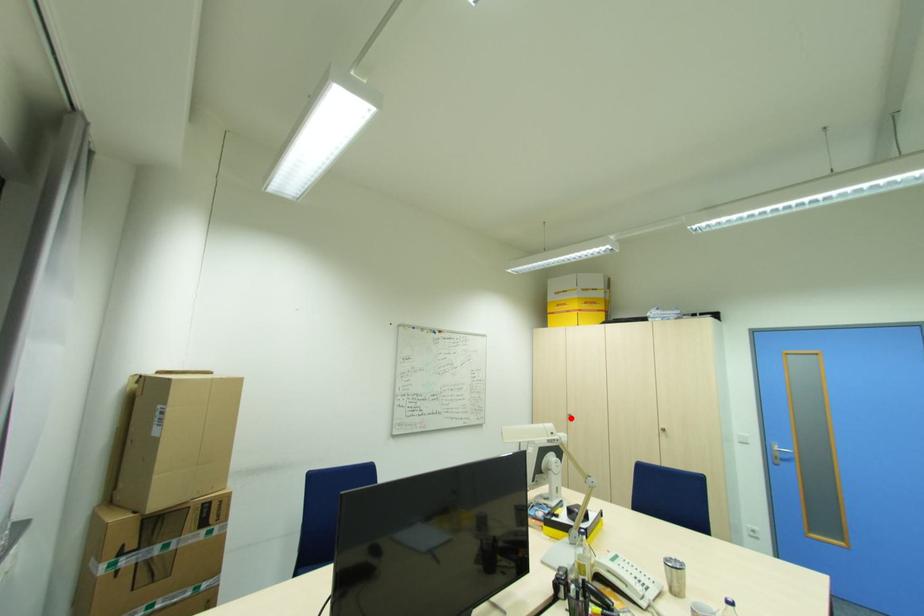
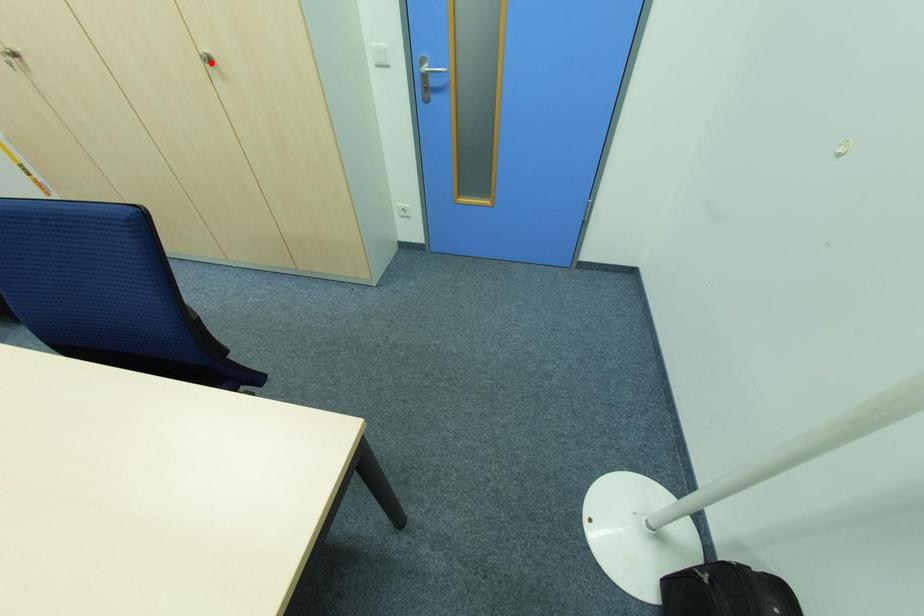
I am providing you with two images of the same scene from different viewpoints. A red point is marked on the first image and another point is marked on the second image. Is the red point in image1 aligned with the point shown in image2?

No